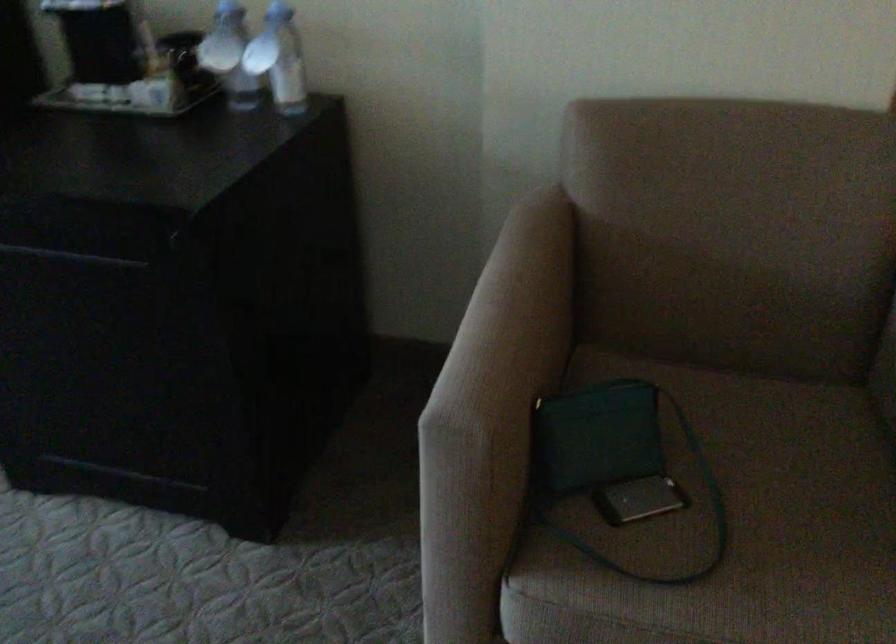
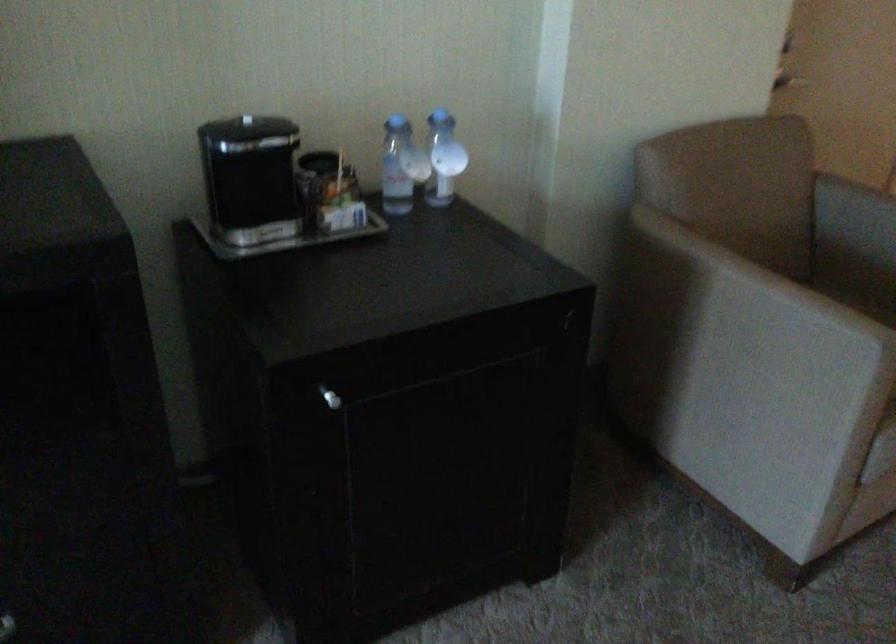
In the second image, find the point that corresponds to the point at 808,431 in the first image.

(859, 303)